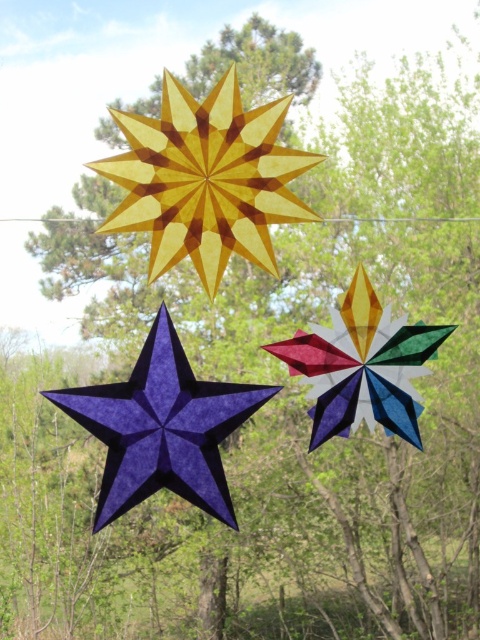
You are a bird flying near the suspended stars and want to land on the closest one. Which one should you choose between the matte purple paper star at center and the multicolored paper star at center?

Both the matte purple paper star at center and the multicolored paper star at center are at the same central position, so you can choose either one since they are equally close to you.

You are an artist hanging decorations for an event. You have two stars to place on a display stand. The matte purple paper star at center and the multicolored paper star at center. According to the image, which star should be placed lower on the stand?

The matte purple paper star at center should be placed lower on the stand because it is positioned below the multicolored paper star at center in the image.